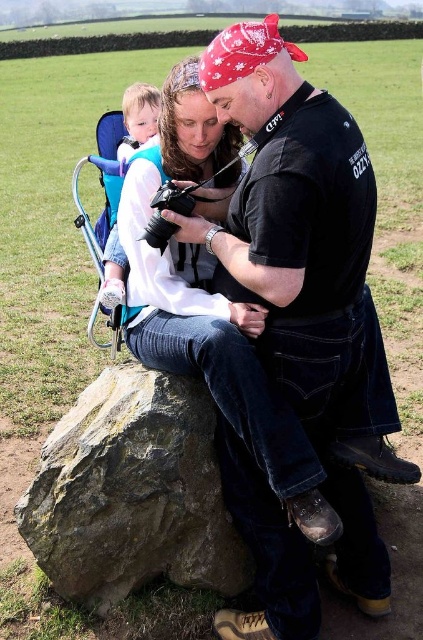
You are a photographer standing at the camera position. You want to hand the camera to the baby, who is holding the black leather jacket at center. Can you reach the baby without moving from your current position?

The black leather jacket at center is 2.00 meters away from the camera. Since the baby is holding the jacket, the baby is also 2.00 meters away. The average human arm length is about 0.7 meters, so you cannot reach the baby without moving.